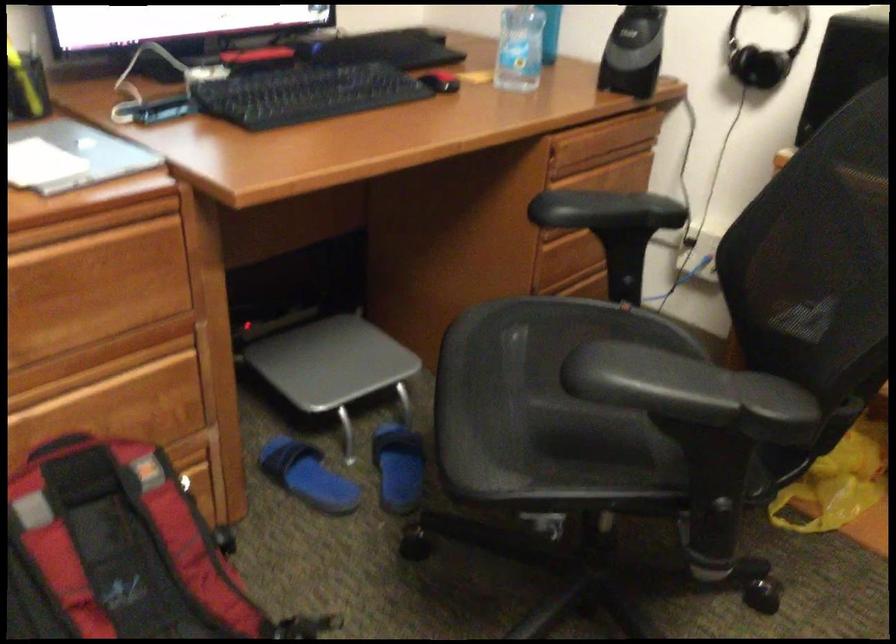
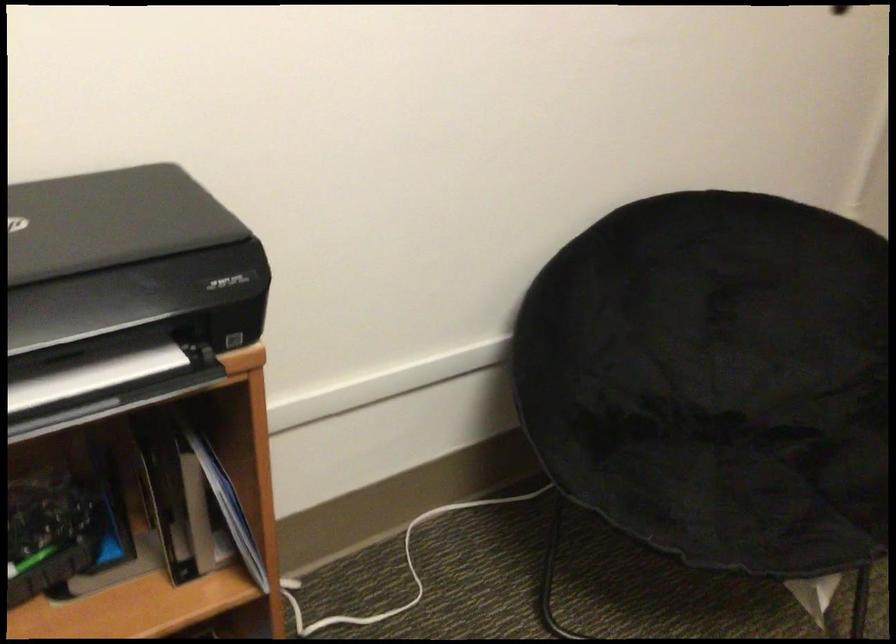
How did the camera likely rotate?

The camera's rotation is toward right-down.